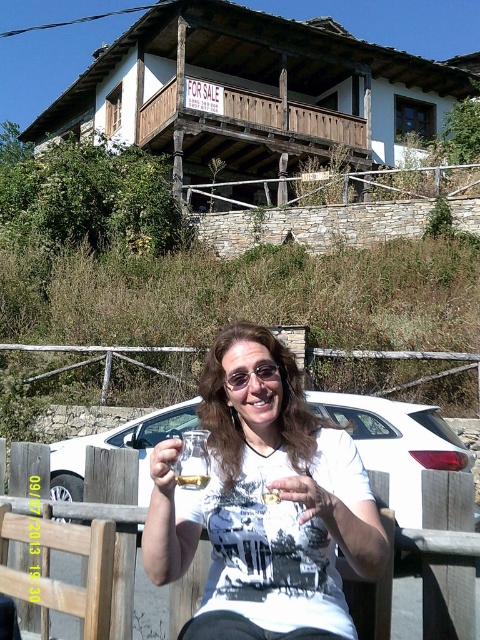
Does point (297, 602) lie in front of point (196, 468)?

Yes, it is in front of point (196, 468).

Can you confirm if white matte t-shirt at center is shorter than clear glass wine glass at center?

No, white matte t-shirt at center is not shorter than clear glass wine glass at center.

Locate an element on the screen. The width and height of the screenshot is (480, 640). white matte t-shirt at center is located at coordinates (264, 502).

Can you confirm if clear glass wine glass at center is positioned to the right of translucent glass at center?

Incorrect, clear glass wine glass at center is not on the right side of translucent glass at center.

Is point (206, 476) closer to camera compared to point (188, 481)?

No, (206, 476) is further to viewer.

Find the location of a particular element. This screenshot has width=480, height=640. clear glass wine glass at center is located at coordinates (192, 460).

Which of these two, white matte t-shirt at center or translucent glass at center, stands shorter?

translucent glass at center is shorter.

Which is behind, point (278, 456) or point (204, 477)?

The point (278, 456) is behind.

Find the location of `white matte t-shirt at center`. white matte t-shirt at center is located at coordinates (264, 502).